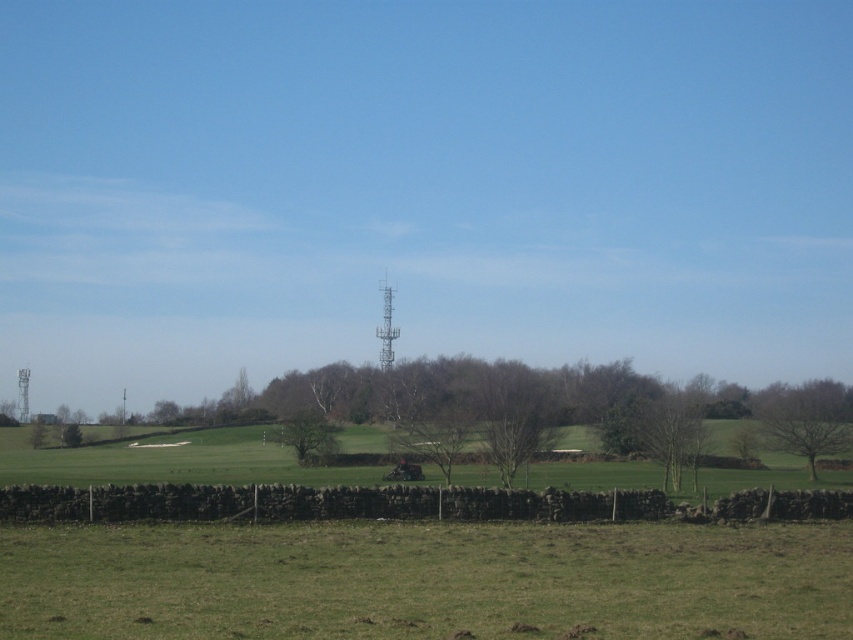
You are standing in the rural landscape and notice the bare branches at lower right and the green leafy tree at lower left. Which one appears closer to you?

The bare branches at lower right is in front of green leafy tree at lower left, so it appears closer to you.

You are a farmer who needs to plant seeds in the green grass at lower center and the green matte tree at lower right. Which area requires more seeds based on their size?

The green grass at lower center requires more seeds because it has a larger size compared to the green matte tree at lower right.